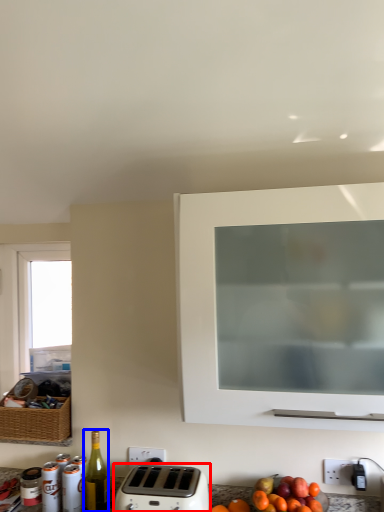
Question: Which object is further to the camera taking this photo, toaster (highlighted by a red box) or bottle (highlighted by a blue box)?

Choices:
 (A) toaster
 (B) bottle

Answer: (B)